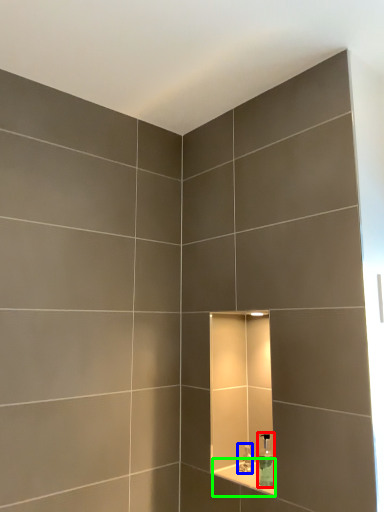
Question: Based on their relative distances, which object is nearer to soap dispenser (highlighted by a red box)? Choose from faucet (highlighted by a blue box) and ledge (highlighted by a green box).

Choices:
 (A) faucet
 (B) ledge

Answer: (B)